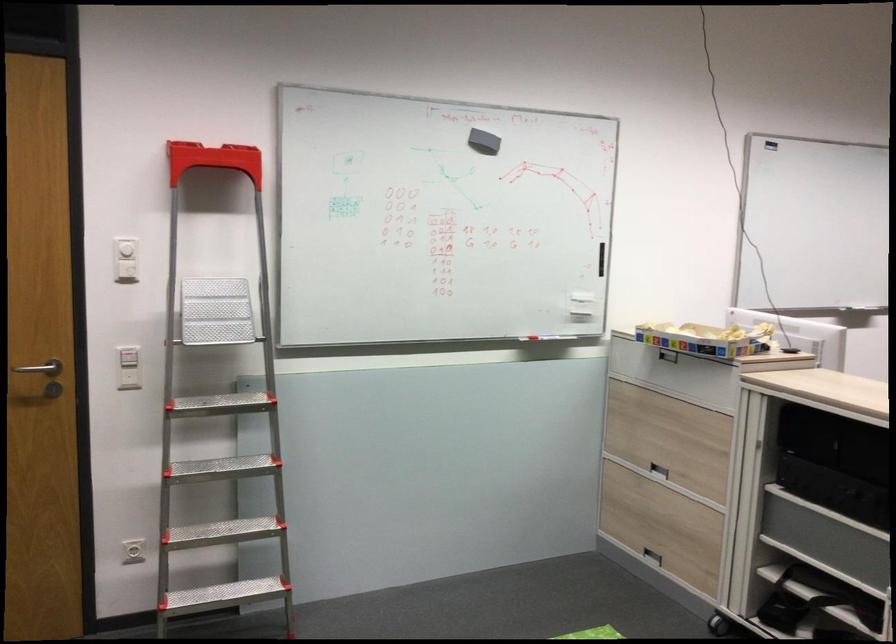
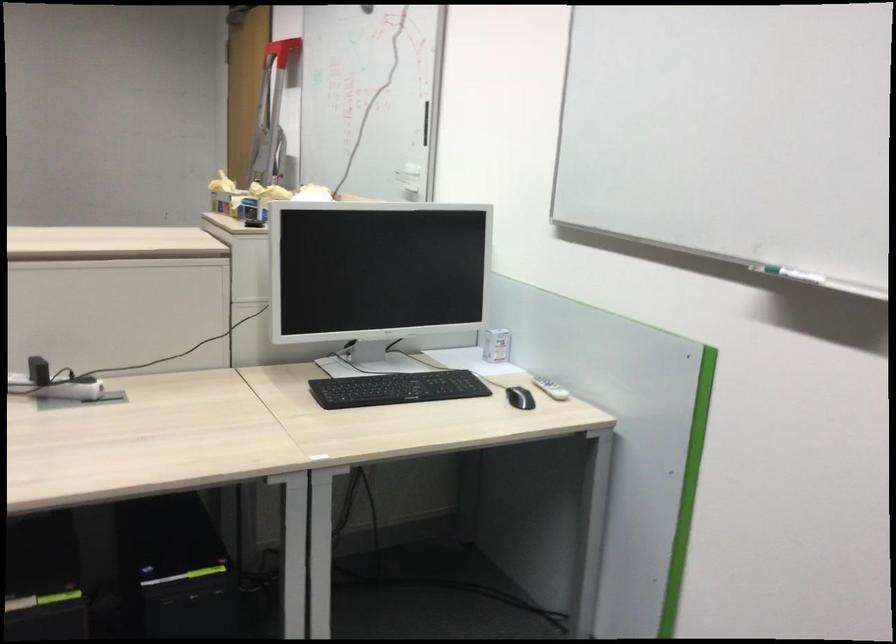
Question: I am providing you with two images of the same scene from different viewpoints. Please identify which objects are invisible in image2.

Choices:
 (A) white remote control
 (B) silver keyhole
 (C) whiteboard marker
 (D) white  wall button

Answer: (D)